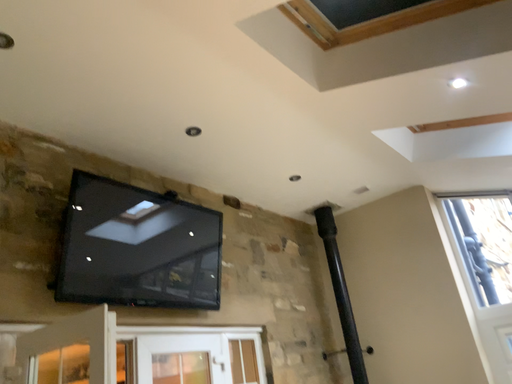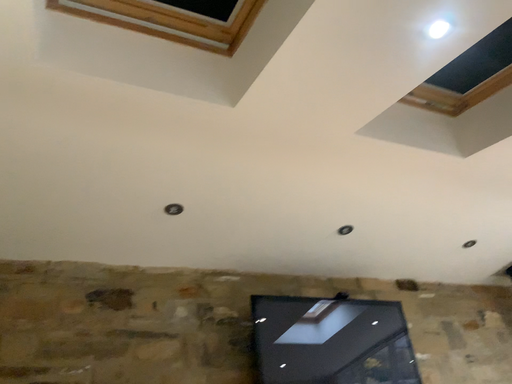
Question: How did the camera likely rotate when shooting the video?

Choices:
 (A) rotated upward
 (B) rotated downward

Answer: (A)